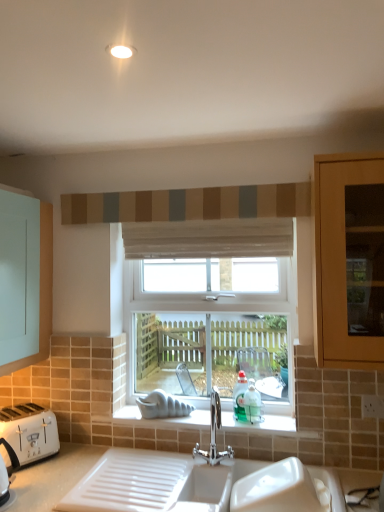
What do you see at coordinates (209, 238) in the screenshot?
I see `white sheer curtain at center, which is counted as the 1th curtain, starting from the bottom` at bounding box center [209, 238].

The image size is (384, 512). I want to click on teal glass bottle at window, so click(248, 405).

Is polished chrome tap at center positioned behind white sheer curtain at center, which is counted as the 2th curtain, starting from the top?

No, polished chrome tap at center is closer to the viewer.

Is polished chrome tap at center oriented away from white sheer curtain at center, which is counted as the 1th curtain, starting from the bottom?

No, polished chrome tap at center's orientation is not away from white sheer curtain at center, which is counted as the 1th curtain, starting from the bottom.

From a real-world perspective, is polished chrome tap at center positioned over white sheer curtain at center, which is counted as the 2th curtain, starting from the top, based on gravity?

Actually, polished chrome tap at center is physically below white sheer curtain at center, which is counted as the 2th curtain, starting from the top, in the real world.

Which is more to the left, clear glass window at center or polished chrome tap at center?

Positioned to the left is clear glass window at center.

Looking at this image, is clear glass window at center looking in the opposite direction of polished chrome tap at center?

No, clear glass window at center's orientation is not away from polished chrome tap at center.

What's the angular difference between clear glass window at center and polished chrome tap at center's facing directions?

44.2 degrees.

From a real-world perspective, is clear glass window at center physically above polished chrome tap at center?

Correct, in the physical world, clear glass window at center is higher than polished chrome tap at center.

Considering the relative positions of white sheer curtain at center, which is counted as the 2th curtain, starting from the top, and textured fabric curtain at upper center, which is the second curtain from bottom to top, in the image provided, is white sheer curtain at center, which is counted as the 2th curtain, starting from the top, to the left of textured fabric curtain at upper center, which is the second curtain from bottom to top, from the viewer's perspective?

No.

Could you measure the distance between white sheer curtain at center, which is counted as the 1th curtain, starting from the bottom, and textured fabric curtain at upper center, which is counted as the 1th curtain, starting from the top?

A distance of 15.21 centimeters exists between white sheer curtain at center, which is counted as the 1th curtain, starting from the bottom, and textured fabric curtain at upper center, which is counted as the 1th curtain, starting from the top.

Is point (201, 247) less distant than point (271, 198)?

That is False.

You are a GUI agent. You are given a task and a screenshot of the screen. Output one action in this format:
    pyautogui.click(x=<x>, y=<y>)
    Task: Click on the curtain below the textured fabric curtain at upper center, which is the second curtain from bottom to top (from the image's perspective)
    This screenshot has height=512, width=384.
    Given the screenshot: What is the action you would take?
    pos(209,238)

Where is `window behind the textured fabric curtain at upper center, which is counted as the 1th curtain, starting from the top`? The width and height of the screenshot is (384, 512). window behind the textured fabric curtain at upper center, which is counted as the 1th curtain, starting from the top is located at coordinates (210, 325).

From the picture: How different are the orientations of clear glass window at center and textured fabric curtain at upper center, which is the second curtain from bottom to top, in degrees?

They differ by 0.553 degrees in their facing directions.

Considering the sizes of objects clear glass window at center and textured fabric curtain at upper center, which is counted as the 1th curtain, starting from the top, in the image provided, who is wider, clear glass window at center or textured fabric curtain at upper center, which is counted as the 1th curtain, starting from the top,?

With larger width is clear glass window at center.

Is the surface of clear glass window at center in direct contact with textured fabric curtain at upper center, which is counted as the 1th curtain, starting from the top?

They are not placed beside each other.

Between teal glass bottle at window and textured fabric curtain at upper center, which is counted as the 1th curtain, starting from the top, which one has larger width?

With larger width is teal glass bottle at window.

Is teal glass bottle at window not inside textured fabric curtain at upper center, which is the second curtain from bottom to top?

Indeed, teal glass bottle at window is completely outside textured fabric curtain at upper center, which is the second curtain from bottom to top.

Who is bigger, teal glass bottle at window or textured fabric curtain at upper center, which is the second curtain from bottom to top?

textured fabric curtain at upper center, which is the second curtain from bottom to top.

From the picture: Is polished chrome tap at center oriented towards teal glass bottle at window?

No, polished chrome tap at center is not facing towards teal glass bottle at window.

Does polished chrome tap at center have a greater height compared to teal glass bottle at window?

Yes.

Which point is more distant from viewer, (212, 460) or (235, 399)?

The point (235, 399) is more distant.

From a real-world perspective, between polished chrome tap at center and textured fabric curtain at upper center, which is counted as the 1th curtain, starting from the top, who is vertically higher?

textured fabric curtain at upper center, which is counted as the 1th curtain, starting from the top.

Would you say polished chrome tap at center is inside or outside textured fabric curtain at upper center, which is counted as the 1th curtain, starting from the top?

The correct answer is: outside.

In the image, is polished chrome tap at center positioned in front of or behind textured fabric curtain at upper center, which is counted as the 1th curtain, starting from the top?

Visually, polished chrome tap at center is located in front of textured fabric curtain at upper center, which is counted as the 1th curtain, starting from the top.

In the scene shown: Is polished chrome tap at center taller or shorter than textured fabric curtain at upper center, which is the second curtain from bottom to top?

Considering their sizes, polished chrome tap at center has more height than textured fabric curtain at upper center, which is the second curtain from bottom to top.

Starting from the polished chrome tap at center, which curtain is the 1st one to the left? Please provide its 2D coordinates.

[(209, 238)]

Where is `window above the polished chrome tap at center (from a real-world perspective)`? window above the polished chrome tap at center (from a real-world perspective) is located at coordinates (210, 325).

Considering their positions, is teal glass bottle at window positioned closer to clear glass window at center than white plastic toaster at lower left?

The object closer to clear glass window at center is teal glass bottle at window.

Considering their positions, is white sheer curtain at center, which is counted as the 2th curtain, starting from the top, positioned further to polished chrome tap at center than textured fabric curtain at upper center, which is the second curtain from bottom to top?

textured fabric curtain at upper center, which is the second curtain from bottom to top, is further to polished chrome tap at center.

From the image, which object appears to be farther from teal glass bottle at window, polished chrome tap at center or white sheer curtain at center, which is counted as the 1th curtain, starting from the bottom?

white sheer curtain at center, which is counted as the 1th curtain, starting from the bottom, lies further to teal glass bottle at window than the other object.

From the image, which object appears to be farther from textured fabric curtain at upper center, which is counted as the 1th curtain, starting from the top, polished chrome tap at center or white sheer curtain at center, which is counted as the 1th curtain, starting from the bottom?

Based on the image, polished chrome tap at center appears to be further to textured fabric curtain at upper center, which is counted as the 1th curtain, starting from the top.

Estimate the real-world distances between objects in this image. Which object is further from textured fabric curtain at upper center, which is counted as the 1th curtain, starting from the top, clear glass window at center or teal glass bottle at window?

teal glass bottle at window is positioned further to the anchor textured fabric curtain at upper center, which is counted as the 1th curtain, starting from the top.

Looking at the image, which one is located further to teal glass bottle at window, polished chrome tap at center or textured fabric curtain at upper center, which is the second curtain from bottom to top?

Among the two, textured fabric curtain at upper center, which is the second curtain from bottom to top, is located further to teal glass bottle at window.

Estimate the real-world distances between objects in this image. Which object is further from polished chrome tap at center, textured fabric curtain at upper center, which is counted as the 1th curtain, starting from the top, or teal glass bottle at window?

textured fabric curtain at upper center, which is counted as the 1th curtain, starting from the top, lies further to polished chrome tap at center than the other object.

Looking at the image, which one is located closer to white sheer curtain at center, which is counted as the 2th curtain, starting from the top, textured fabric curtain at upper center, which is counted as the 1th curtain, starting from the top, or teal glass bottle at window?

The object closer to white sheer curtain at center, which is counted as the 2th curtain, starting from the top, is textured fabric curtain at upper center, which is counted as the 1th curtain, starting from the top.

What are the coordinates of `curtain between textured fabric curtain at upper center, which is counted as the 1th curtain, starting from the top, and teal glass bottle at window from top to bottom` in the screenshot? It's located at tap(209, 238).

The image size is (384, 512). In order to click on curtain between textured fabric curtain at upper center, which is counted as the 1th curtain, starting from the top, and polished chrome tap at center vertically in this screenshot , I will do `click(209, 238)`.

The height and width of the screenshot is (512, 384). In order to click on teal between clear glass window at center and polished chrome tap at center from top to bottom in this screenshot , I will do `click(248, 405)`.

At what (x,y) coordinates should I click in order to perform the action: click on teal between textured fabric curtain at upper center, which is the second curtain from bottom to top, and polished chrome tap at center vertically. Please return your answer as a coordinate pair (x, y). Looking at the image, I should click on (248, 405).